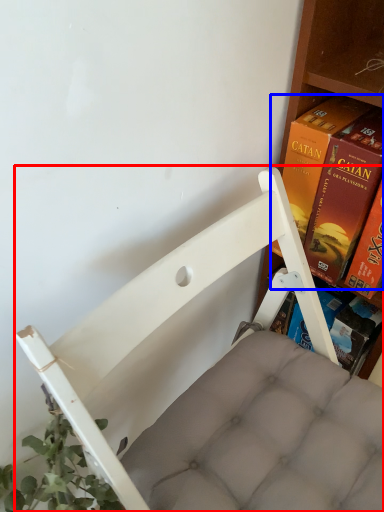
Question: Which of the following is the farthest to the observer, furniture (highlighted by a red box) or book (highlighted by a blue box)?

Choices:
 (A) furniture
 (B) book

Answer: (B)